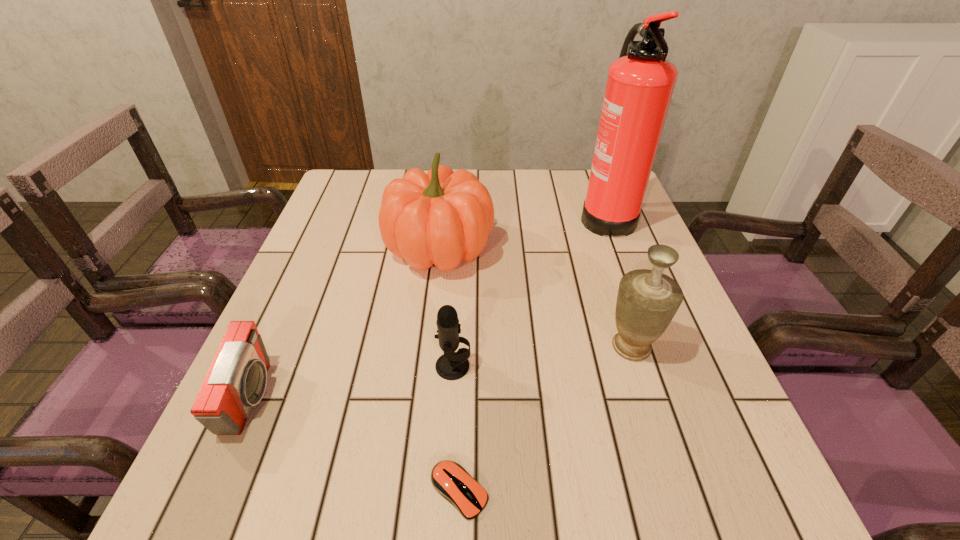
Where is `free spot located 0.310m at the nozzle of the fire extinguisher`? This screenshot has width=960, height=540. free spot located 0.310m at the nozzle of the fire extinguisher is located at coordinates (466, 214).

Where is `vacant space situated on the back of the pumpkin`? Image resolution: width=960 pixels, height=540 pixels. vacant space situated on the back of the pumpkin is located at coordinates (445, 197).

You are a GUI agent. You are given a task and a screenshot of the screen. Output one action in this format:
    pyautogui.click(x=<x>, y=<y>)
    Task: Click on the free space located on the front of the urn
    
    Given the screenshot: What is the action you would take?
    pyautogui.click(x=653, y=412)

The width and height of the screenshot is (960, 540). Identify the location of vacant space located on the right of the microphone. (625, 366).

Where is `vacant space located on the front-facing side of the leftmost object`? Image resolution: width=960 pixels, height=540 pixels. vacant space located on the front-facing side of the leftmost object is located at coordinates (494, 398).

Where is `vacant region located 0.170m on the left of the nearest object`? vacant region located 0.170m on the left of the nearest object is located at coordinates (317, 491).

Where is `object that is at the far edge`? Image resolution: width=960 pixels, height=540 pixels. object that is at the far edge is located at coordinates (640, 83).

You are a GUI agent. You are given a task and a screenshot of the screen. Output one action in this format:
    pyautogui.click(x=<x>, y=<y>)
    Task: Click on the object present at the near edge
    Image resolution: width=960 pixels, height=540 pixels.
    Given the screenshot: What is the action you would take?
    pyautogui.click(x=449, y=479)

Image resolution: width=960 pixels, height=540 pixels. What are the coordinates of `object present at the left edge` in the screenshot? It's located at (236, 381).

Find the location of a particular element. The width and height of the screenshot is (960, 540). fire extinguisher that is positioned at the right edge is located at coordinates (640, 83).